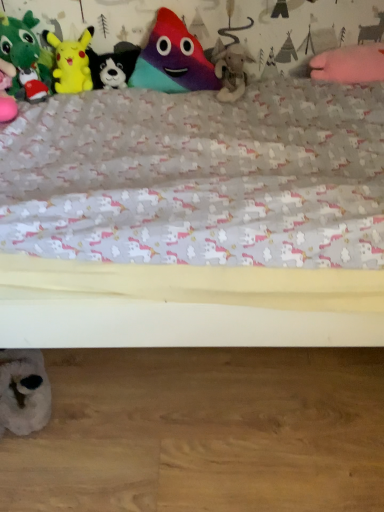
Identify the location of vacant space in front of white plush toy at lower left, marked as the 6th toy in a top-to-bottom arrangement. (38, 469).